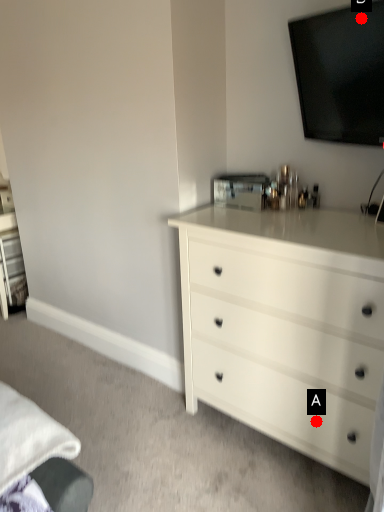
Question: Two points are circled on the image, labeled by A and B beside each circle. Which point appears closest to the camera in this image?

Choices:
 (A) A is closer
 (B) B is closer

Answer: (B)